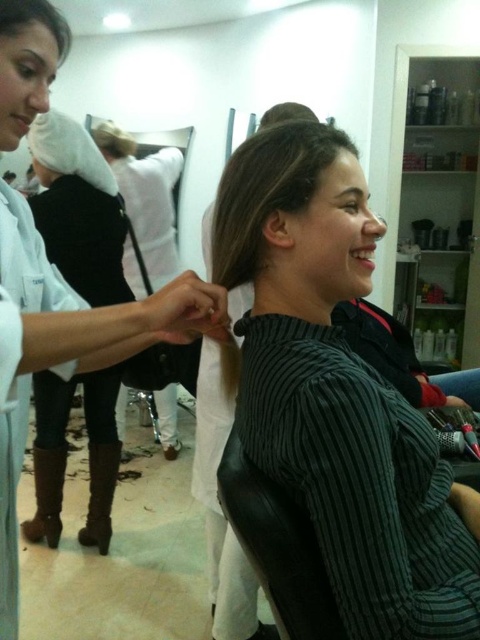
You are a customer in a hair salon and you see the black corduroy shirt at center and the brown matte hair at upper center. Which object is taller?

The black corduroy shirt at center is much taller than the brown matte hair at upper center.

You are a customer in the salon and want to check if your black corduroy shirt at center is larger than the brown matte hair at upper center. Can you confirm?

The black corduroy shirt at center is bigger than brown matte hair at upper center, so yes, the black corduroy shirt at center is larger than the brown matte hair at upper center.

From the picture: You are a customer in the salon and want to know if the white fabric at upper left can cover your entire hand. The matte black hand at lower right is your hand. Can it?

The white fabric at upper left might be wider than matte black hand at lower right, so it is possible that the white fabric at upper left can cover your entire hand.